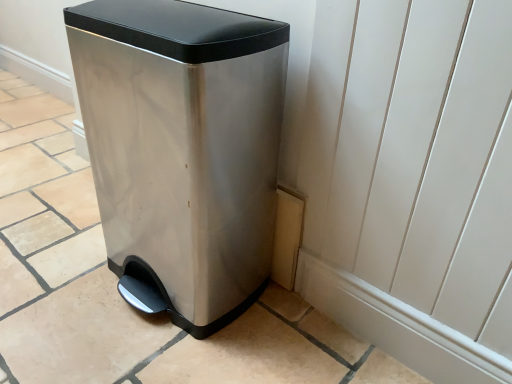
I want to click on free spot below stainless steel trash can at lower left (from a real-world perspective), so click(211, 296).